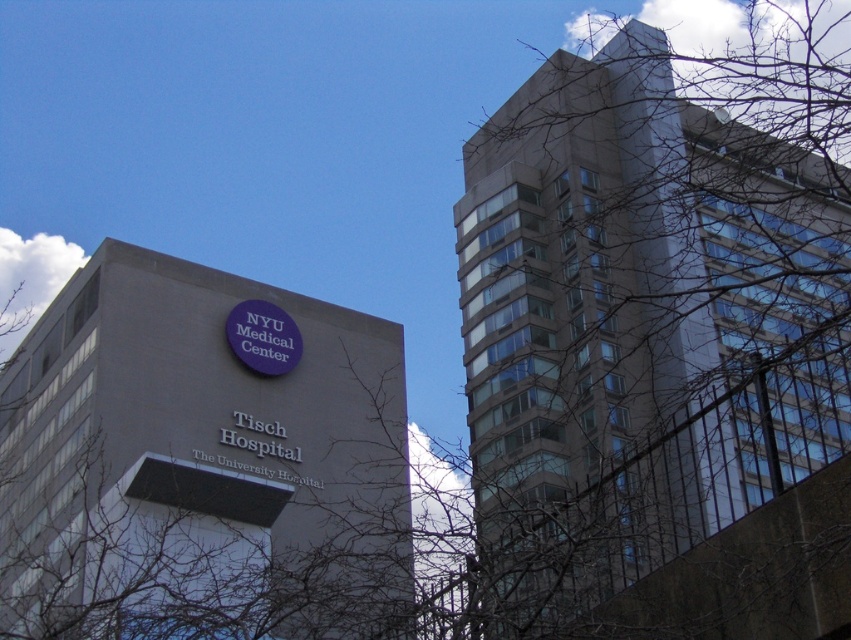
Question: Among these objects, which one is farthest from the camera?

Choices:
 (A) gray concrete building at center
 (B) purple matte sign at center
 (C) bare branches at upper left

Answer: (B)

Question: Is bare branches at upper left smaller than purple matte sign at center?

Choices:
 (A) no
 (B) yes

Answer: (A)

Question: Observing the image, what is the correct spatial positioning of gray concrete building at center in reference to purple matte sign at center?

Choices:
 (A) right
 (B) left

Answer: (B)

Question: Is bare branches at upper left above purple matte sign at center?

Choices:
 (A) yes
 (B) no

Answer: (A)

Question: Which of the following is the closest to the observer?

Choices:
 (A) gray concrete building at center
 (B) bare branches at upper left
 (C) purple matte sign at center

Answer: (B)

Question: Considering the real-world distances, which object is closest to the bare branches at upper left?

Choices:
 (A) gray concrete building at center
 (B) purple matte sign at center

Answer: (A)